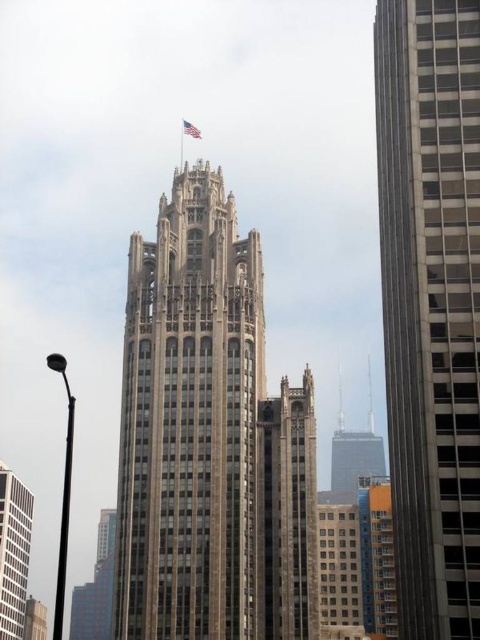
You are standing at the base of the skyscraper and want to take a photo of the point labeled as point (14, 493). Given that your camera has a maximum focus range of 150 meters, will you be able to capture this point clearly?

The point labeled point (14, 493) is 140.18 meters away from the camera. Since this distance is within the camera maximum focus range of 150 meters, you can capture it clearly.

You are standing in front of the skyscraper and notice two points marked on the building. The first point is at coordinates point (126, 385) and the second is at point (186, 122). From your perspective, which point is closer to you?

Point (126, 385) is in front of point (186, 122), so it is closer to you.

In the scene shown: You are standing at the base of the skyscraper and want to take a photo of both the flagpole and the intricate spires. You notice two specific points marked on your map as point 1 at coordinates point (8, 625) and point 2 at coordinates point (188, 124). Which point should you stand at to ensure both the flagpole and the spires are fully visible in your photo without any obstruction?

You should stand at point 2 at coordinates point (188, 124) because point 1 at coordinates point (8, 625) is behind it, meaning standing at point 2 will provide an unobstructed view of both the flagpole and the spires.